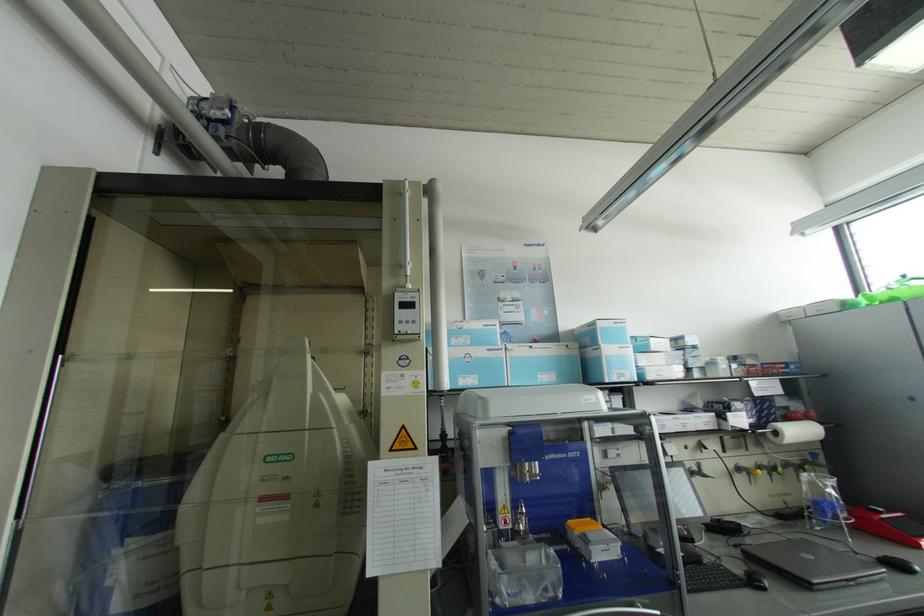
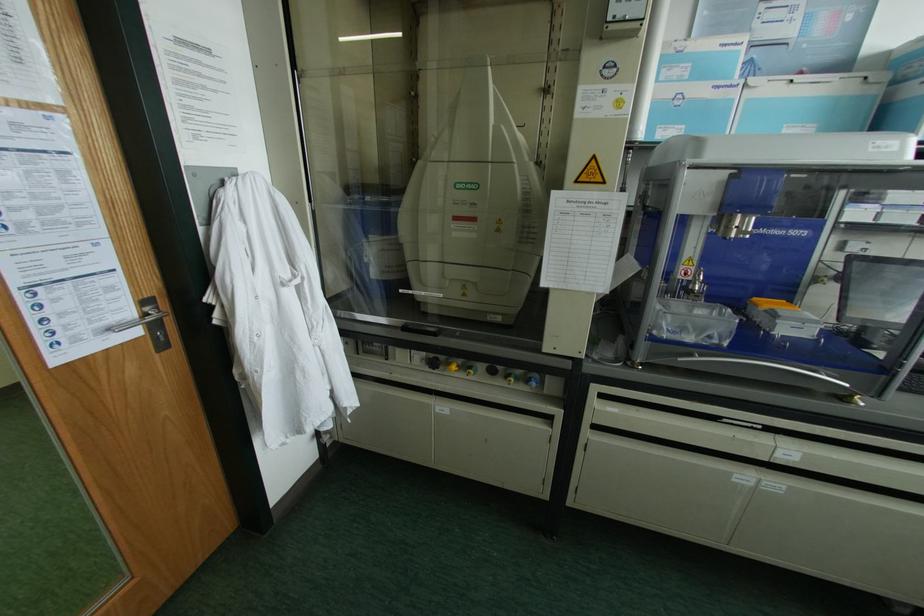
Locate, in the second image, the point that corresponds to point 262,498 in the first image.

(455, 217)